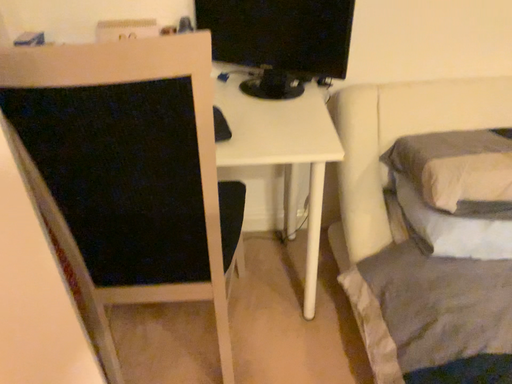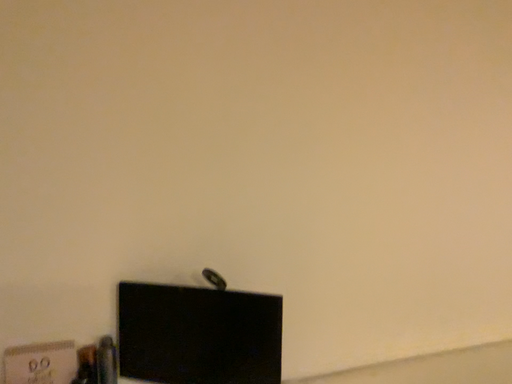
Question: Which way did the camera rotate in the video?

Choices:
 (A) rotated upward
 (B) rotated downward

Answer: (A)